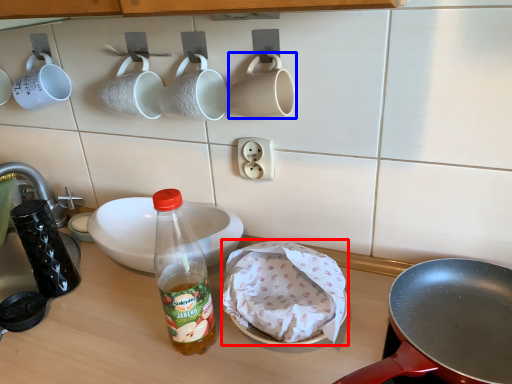
Question: Which point is further to the camera, food (highlighted by a red box) or coffee cup (highlighted by a blue box)?

Choices:
 (A) food
 (B) coffee cup

Answer: (B)